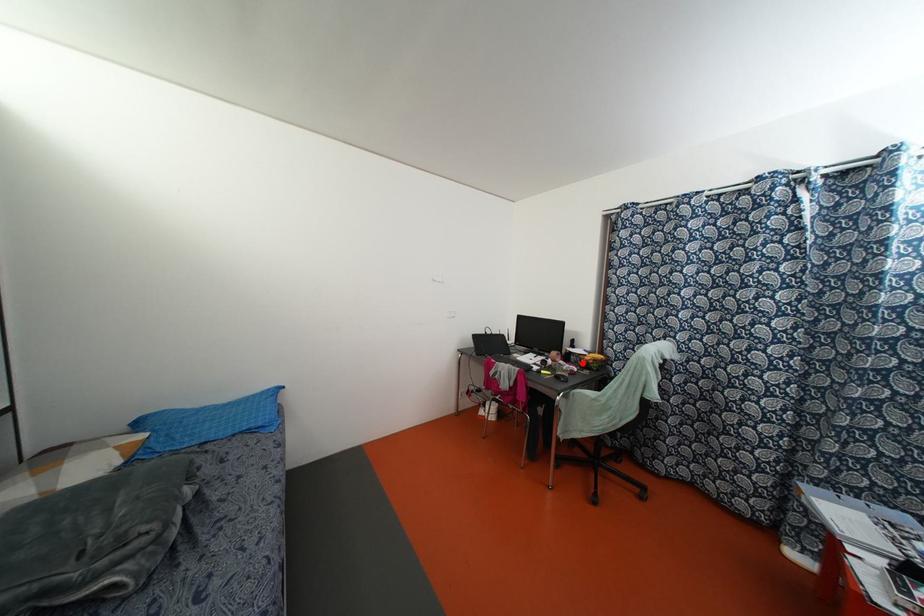
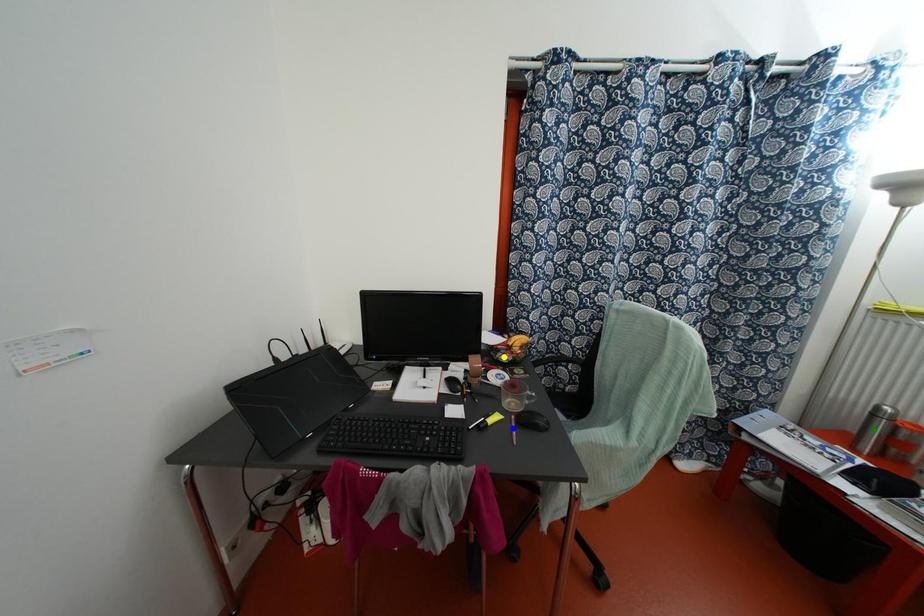
Question: I am providing you with two images of the same scene from different viewpoints. A red point is marked on the first image. You are given multiple points on the second image. Which point in image 2 is actually the same real-world point as the red point in image 1?

Choices:
 (A) yellow point
 (B) green point
 (C) blue point

Answer: (A)